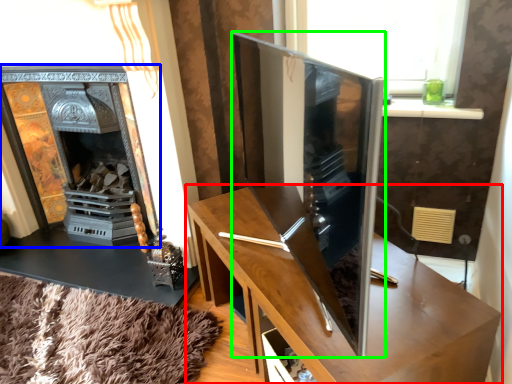
Question: Which object is the closest to the table (highlighted by a red box)? Choose among these: fireplace (highlighted by a blue box) or tv cabinet (highlighted by a green box).

Choices:
 (A) fireplace
 (B) tv cabinet

Answer: (B)